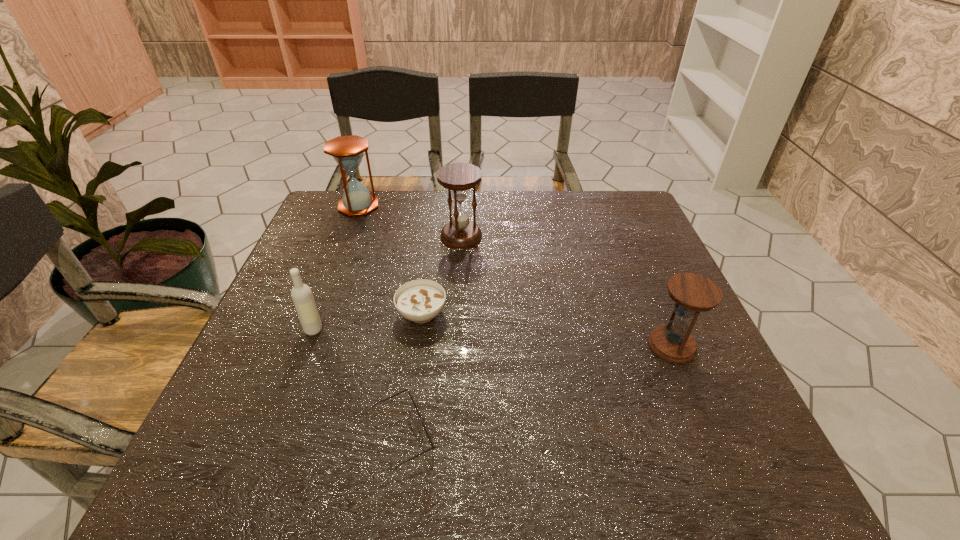
Find the location of a particular element. The image size is (960, 540). the second closest hourglass to the rightmost hourglass is located at coordinates (347, 151).

Locate an element on the screen. The width and height of the screenshot is (960, 540). free space that satisfies the following two spatial constraints: 1. on the back side of the second nearest hourglass; 2. on the left side of the soup bowl is located at coordinates (433, 236).